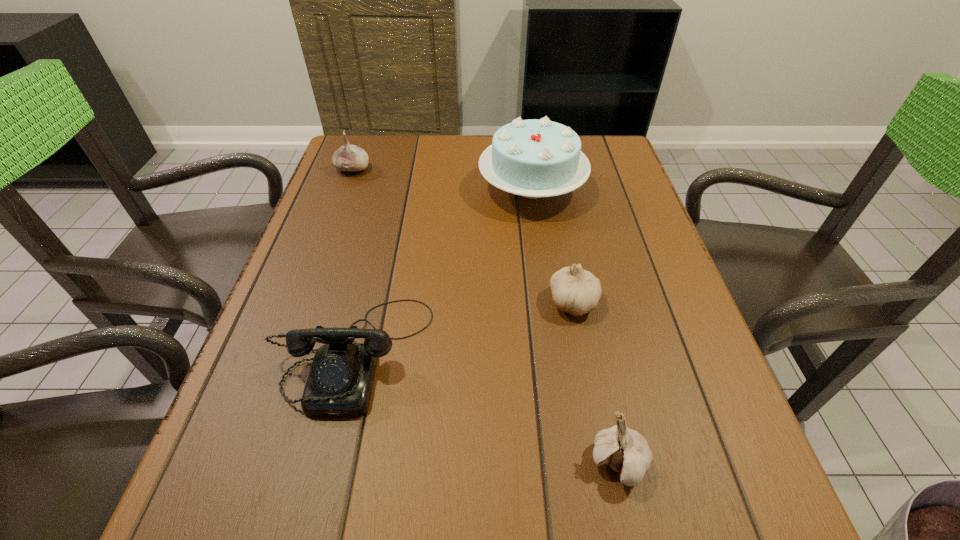
Image resolution: width=960 pixels, height=540 pixels. In order to click on free spot between the farthest garlic and the nearest object in this screenshot , I will do `click(486, 316)`.

At what (x,y) coordinates should I click in order to perform the action: click on empty space between the birthday cake and the second farthest garlic. Please return your answer as a coordinate pair (x, y). Looking at the image, I should click on (553, 245).

Choose which object is the second nearest neighbor to the second nearest garlic. Please provide its 2D coordinates. Your answer should be formatted as a tuple, i.e. [(x, y)], where the tuple contains the x and y coordinates of a point satisfying the conditions above.

[(626, 451)]

At what (x,y) coordinates should I click in order to perform the action: click on the second closest object to the telephone. Please return your answer as a coordinate pair (x, y). Looking at the image, I should click on (626, 451).

Select which garlic appears as the second closest to the second nearest garlic. Please provide its 2D coordinates. Your answer should be formatted as a tuple, i.e. [(x, y)], where the tuple contains the x and y coordinates of a point satisfying the conditions above.

[(349, 157)]

Identify which garlic is located as the nearest to the leftmost garlic. Please provide its 2D coordinates. Your answer should be formatted as a tuple, i.e. [(x, y)], where the tuple contains the x and y coordinates of a point satisfying the conditions above.

[(576, 291)]

Locate an element on the screen. This screenshot has height=540, width=960. vacant space that satisfies the following two spatial constraints: 1. on the front-facing side of the telephone; 2. on the left side of the nearest garlic is located at coordinates (328, 463).